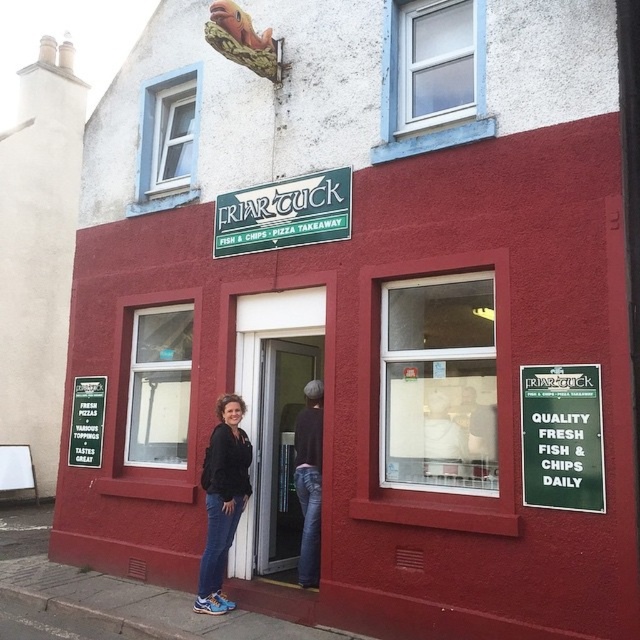
Question: Which of the following is the closest to the observer?

Choices:
 (A) (77, 438)
 (B) (326, 225)

Answer: (B)

Question: Estimate the real-world distances between objects in this image. Which object is closer to the matte black jacket at center?

Choices:
 (A) green matte sign at upper center
 (B) green matte signboard at center right

Answer: (A)

Question: Is green matte signboard at center right below green plastic signboard at center?

Choices:
 (A) yes
 (B) no

Answer: (B)

Question: Does green matte sign at upper center have a larger size compared to green plastic signboard at center?

Choices:
 (A) yes
 (B) no

Answer: (A)

Question: Does green matte sign at upper center appear over green plastic signboard at center?

Choices:
 (A) yes
 (B) no

Answer: (A)

Question: Which point is farther from the camera taking this photo?

Choices:
 (A) (236, 452)
 (B) (77, 451)
 (C) (534, 376)

Answer: (B)